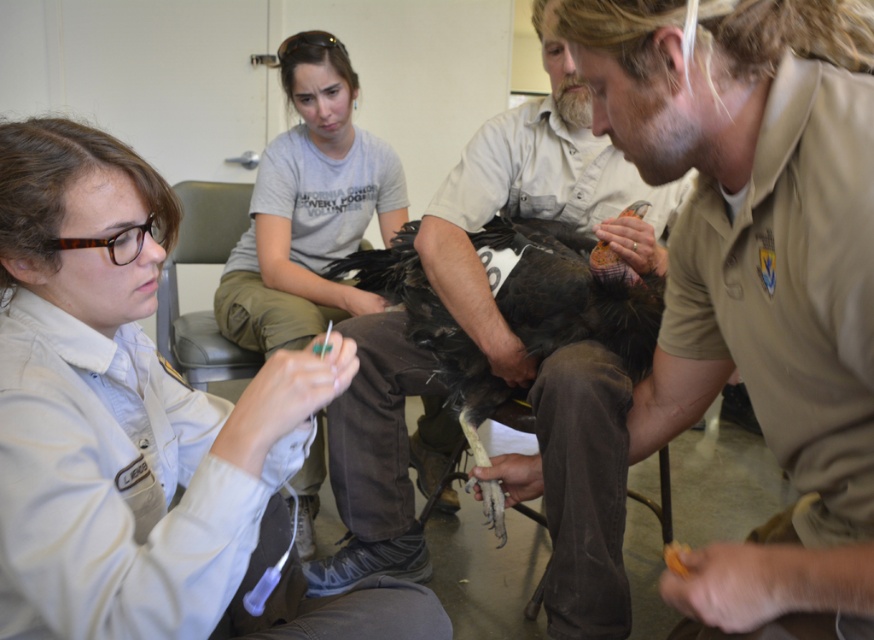
Is gray cotton shirt at upper center thinner than dark brown feathers at center?

Yes, gray cotton shirt at upper center is thinner than dark brown feathers at center.

Looking at this image, who is more distant from viewer, (321,97) or (484,396)?

The point (321,97) is more distant.

Identify the location of gray cotton shirt at upper center. (309, 208).

Who is positioned more to the left, brown leather jacket at center or gray cotton shirt at upper center?

gray cotton shirt at upper center

Between brown leather jacket at center and gray cotton shirt at upper center, which one is positioned higher?

gray cotton shirt at upper center is above.

Between point (793, 451) and point (288, 150), which one is positioned in front?

Point (793, 451) is in front.

The height and width of the screenshot is (640, 874). In order to click on brown leather jacket at center in this screenshot , I will do `click(730, 307)`.

Can you confirm if brown leather jacket at center is shorter than dark brown feathers at center?

In fact, brown leather jacket at center may be taller than dark brown feathers at center.

Does brown leather jacket at center appear on the right side of dark brown feathers at center?

Indeed, brown leather jacket at center is positioned on the right side of dark brown feathers at center.

This screenshot has height=640, width=874. Describe the element at coordinates (730, 307) in the screenshot. I see `brown leather jacket at center` at that location.

This screenshot has height=640, width=874. What are the coordinates of `brown leather jacket at center` in the screenshot? It's located at (730, 307).